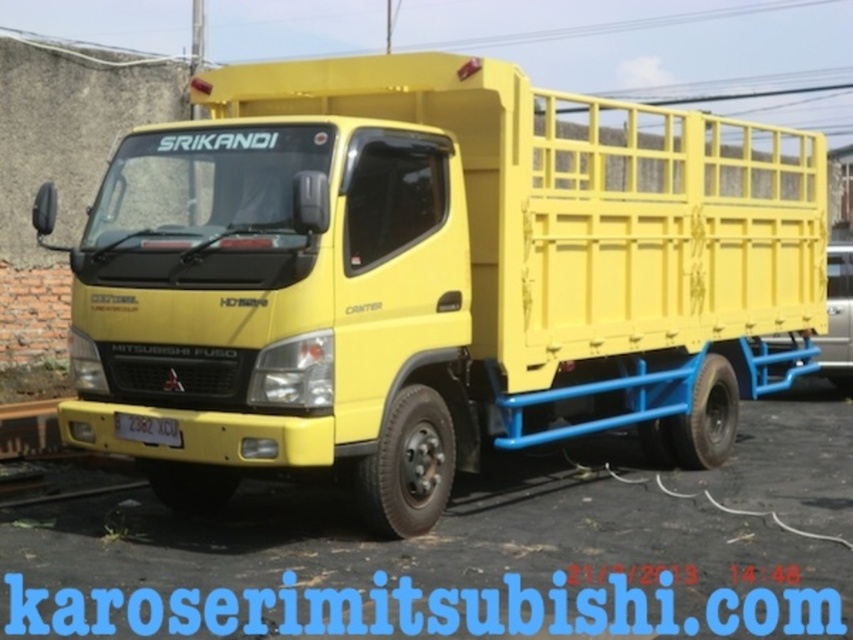
You are a delivery driver who needs to check the height of the yellow metal train track at lower left and the black plastic license plate at center. Which object is taller?

The yellow metal train track at lower left is much taller than the black plastic license plate at center.

You are standing in front of the yellow Mitsubishi Fuso Canter truck and want to locate the yellow metal train track at lower left and the black plastic license plate at center. Which object is closer to the left side of the truck?

The yellow metal train track at lower left is closer to the left side of the truck because it is positioned to the left of the black plastic license plate at center.

You are a delivery driver who needs to park your matte yellow truck at center on the yellow metal train track at lower left. Is the truck currently positioned in a way that allows it to move onto the track without needing to back up?

The matte yellow truck at center is above the yellow metal train track at lower left, so it can move forward to the track without backing up.